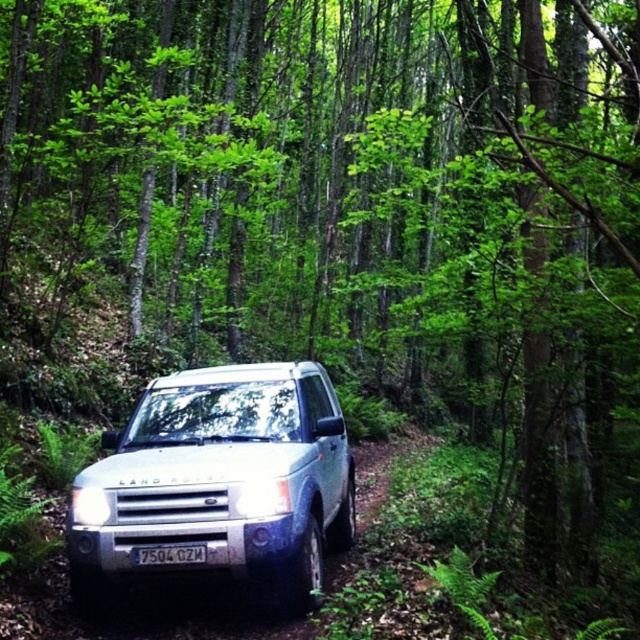
Does point (164, 424) come in front of point (147, 557)?

No.

Does silver metallic suv at center have a smaller size compared to white plastic license plate at center?

Actually, silver metallic suv at center might be larger than white plastic license plate at center.

The height and width of the screenshot is (640, 640). Describe the element at coordinates (220, 483) in the screenshot. I see `silver metallic suv at center` at that location.

Locate an element on the screen. silver metallic suv at center is located at coordinates (220, 483).